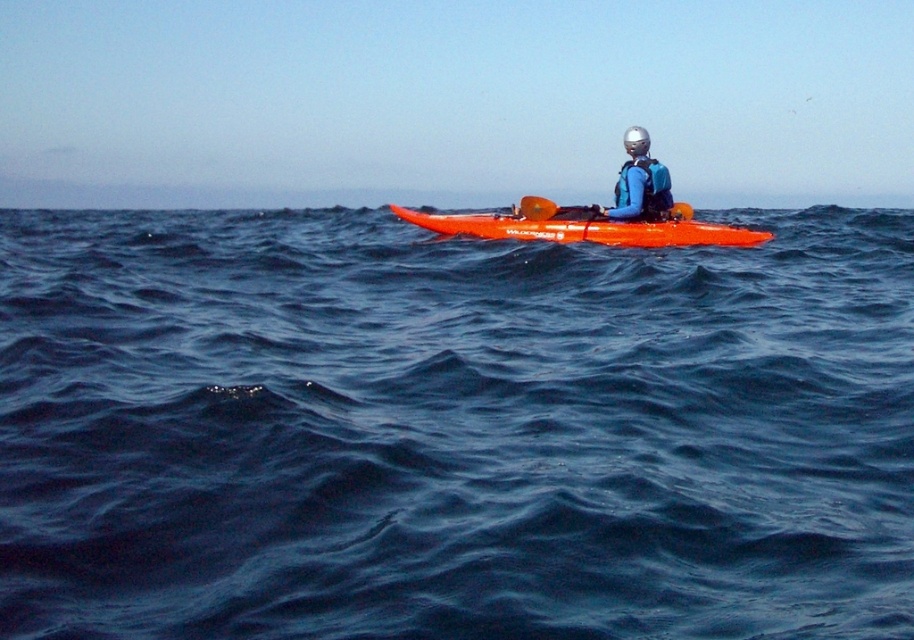
Does blue water at center appear over orange rubber paddle at center?

Actually, blue water at center is below orange rubber paddle at center.

Measure the distance from blue water at center to orange rubber paddle at center.

blue water at center and orange rubber paddle at center are 14.11 feet apart.

Identify the location of blue water at center. (452, 429).

Can you confirm if orange plastic kayak at center is positioned above blue synthetic life jacket at center?

Incorrect, orange plastic kayak at center is not positioned above blue synthetic life jacket at center.

Consider the image. Is orange plastic kayak at center wider than blue synthetic life jacket at center?

Yes.

Is point (647, 227) less distant than point (628, 198)?

Yes.

Identify the location of orange plastic kayak at center. The height and width of the screenshot is (640, 914). (583, 227).

Can you confirm if blue matte wetsuit at center is positioned above silver metallic helmet at upper center?

Actually, blue matte wetsuit at center is below silver metallic helmet at upper center.

Is the position of blue matte wetsuit at center less distant than that of silver metallic helmet at upper center?

That is True.

Identify the location of blue matte wetsuit at center. The height and width of the screenshot is (640, 914). (639, 180).